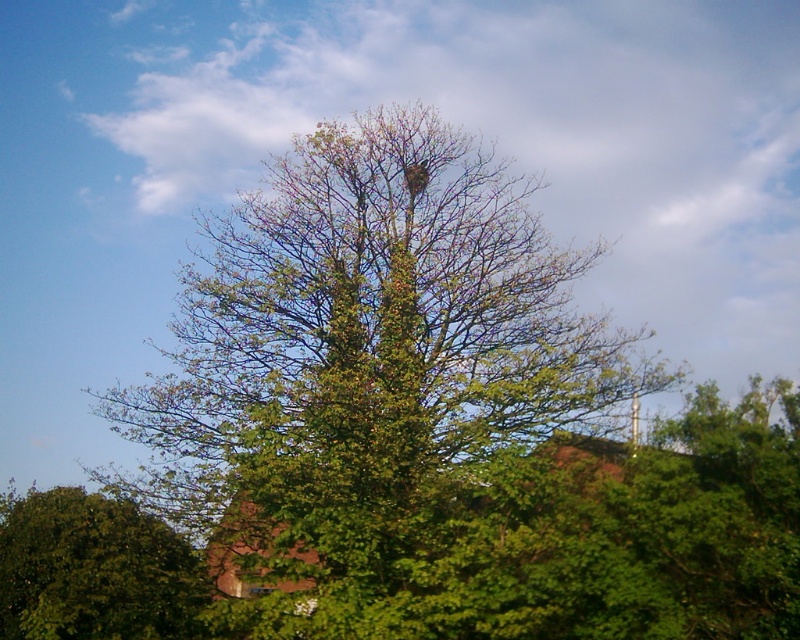
Who is more distant from viewer, (237, 497) or (61, 512)?

Positioned behind is point (61, 512).

Between point (484, 381) and point (76, 502), which one is positioned in front?

Point (76, 502) is in front.

Where is `green leafy tree at center`? The image size is (800, 640). green leafy tree at center is located at coordinates (392, 403).